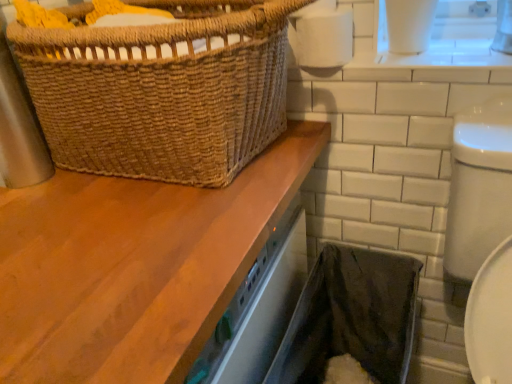
Question: From the image's perspective, is black fabric laundry basket at lower right located above brown woven basket at upper left?

Choices:
 (A) no
 (B) yes

Answer: (A)

Question: Is black fabric laundry basket at lower right wider than brown woven basket at upper left?

Choices:
 (A) no
 (B) yes

Answer: (B)

Question: Considering the relative positions of black fabric laundry basket at lower right and brown woven basket at upper left in the image provided, is black fabric laundry basket at lower right to the left of brown woven basket at upper left from the viewer's perspective?

Choices:
 (A) yes
 (B) no

Answer: (B)

Question: Is black fabric laundry basket at lower right surrounding brown woven basket at upper left?

Choices:
 (A) no
 (B) yes

Answer: (A)

Question: Can you confirm if black fabric laundry basket at lower right is thinner than brown woven basket at upper left?

Choices:
 (A) no
 (B) yes

Answer: (A)

Question: Would you say wooden countertop at upper left is to the left or to the right of black fabric laundry basket at lower right in the picture?

Choices:
 (A) right
 (B) left

Answer: (B)

Question: From a real-world perspective, is wooden countertop at upper left physically located above or below black fabric laundry basket at lower right?

Choices:
 (A) above
 (B) below

Answer: (A)

Question: From their relative heights in the image, would you say wooden countertop at upper left is taller or shorter than black fabric laundry basket at lower right?

Choices:
 (A) tall
 (B) short

Answer: (B)

Question: Is wooden countertop at upper left in front of or behind black fabric laundry basket at lower right in the image?

Choices:
 (A) front
 (B) behind

Answer: (A)

Question: From the image's perspective, is white matte toilet paper at upper right positioned above or below brown woven basket at upper left?

Choices:
 (A) above
 (B) below

Answer: (A)

Question: Considering their positions, is white matte toilet paper at upper right located in front of or behind brown woven basket at upper left?

Choices:
 (A) behind
 (B) front

Answer: (A)

Question: In terms of size, does white matte toilet paper at upper right appear bigger or smaller than brown woven basket at upper left?

Choices:
 (A) big
 (B) small

Answer: (B)

Question: Considering the positions of point (309, 41) and point (198, 34), is point (309, 41) closer or farther from the camera than point (198, 34)?

Choices:
 (A) closer
 (B) farther

Answer: (B)

Question: Looking at their shapes, would you say wooden countertop at upper left is wider or thinner than white matte toilet paper at upper right?

Choices:
 (A) thin
 (B) wide

Answer: (B)

Question: Considering the positions of wooden countertop at upper left and white matte toilet paper at upper right in the image, is wooden countertop at upper left taller or shorter than white matte toilet paper at upper right?

Choices:
 (A) tall
 (B) short

Answer: (B)